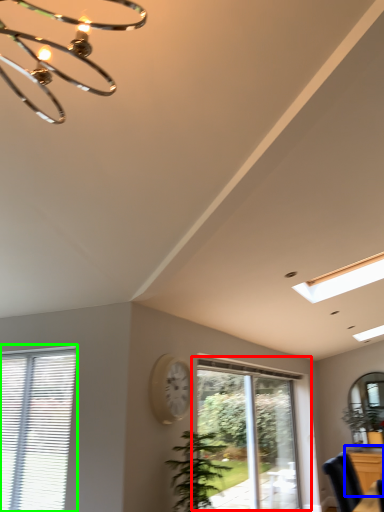
Question: Based on their relative distances, which object is nearer to window (highlighted by a red box)? Choose from dresser (highlighted by a blue box) and window (highlighted by a green box).

Choices:
 (A) dresser
 (B) window

Answer: (A)